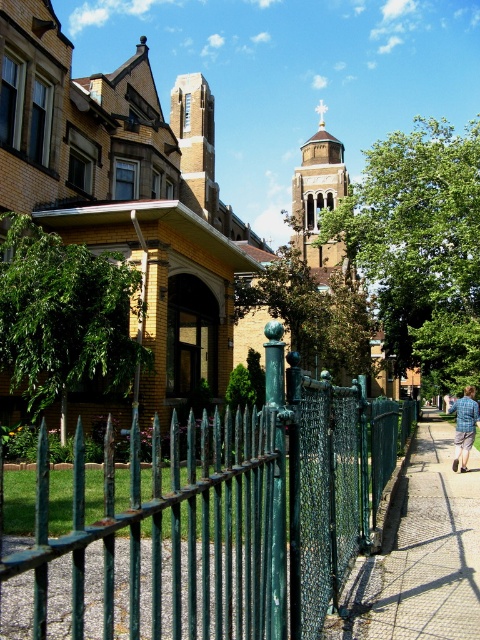
Question: Which object is farther from the camera taking this photo?

Choices:
 (A) smooth concrete sidewalk at lower right
 (B) blue plaid shirt at right
 (C) green metal fence at center

Answer: (B)

Question: Can you confirm if smooth concrete sidewalk at lower right is positioned below blue plaid shirt at right?

Choices:
 (A) no
 (B) yes

Answer: (B)

Question: Does green metal fence at center appear under smooth concrete sidewalk at lower right?

Choices:
 (A) no
 (B) yes

Answer: (A)

Question: Which point is farther to the camera?

Choices:
 (A) (180, 540)
 (B) (457, 428)

Answer: (B)

Question: Which object is the farthest from the blue plaid shirt at right?

Choices:
 (A) smooth concrete sidewalk at lower right
 (B) green metal fence at center

Answer: (B)

Question: From the image, what is the correct spatial relationship of green metal fence at center in relation to smooth concrete sidewalk at lower right?

Choices:
 (A) below
 (B) above

Answer: (B)